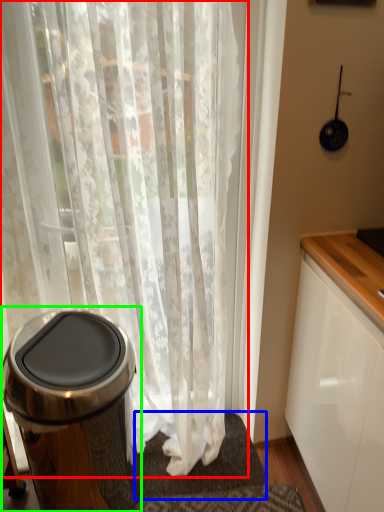
Question: Based on their relative distances, which object is farther from curtain (highlighted by a red box)? Choose from bath mat (highlighted by a blue box) and waste container (highlighted by a green box).

Choices:
 (A) bath mat
 (B) waste container

Answer: (A)